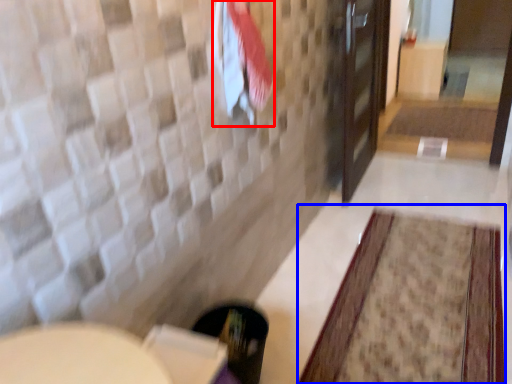
Question: Among these objects, which one is nearest to the camera, beach towel (highlighted by a red box) or bath mat (highlighted by a blue box)?

Choices:
 (A) beach towel
 (B) bath mat

Answer: (A)